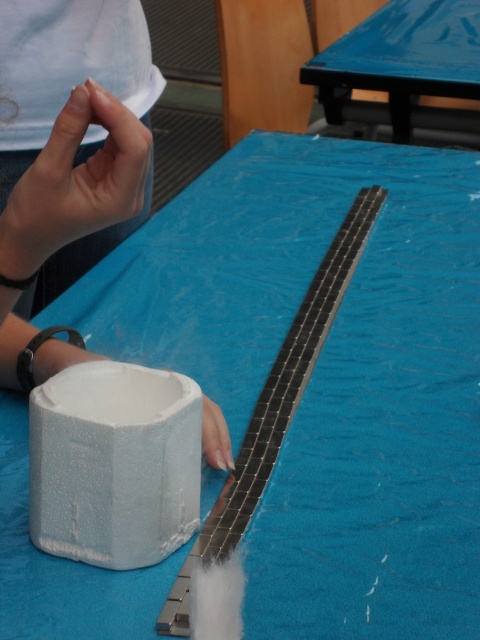
Who is more distant from viewer, (207, 444) or (416, 26)?

The point (416, 26) is behind.

Between point (79, 77) and point (383, 17), which one is positioned behind?

Point (383, 17)

I want to click on white matte foam cup at lower left, so click(69, 147).